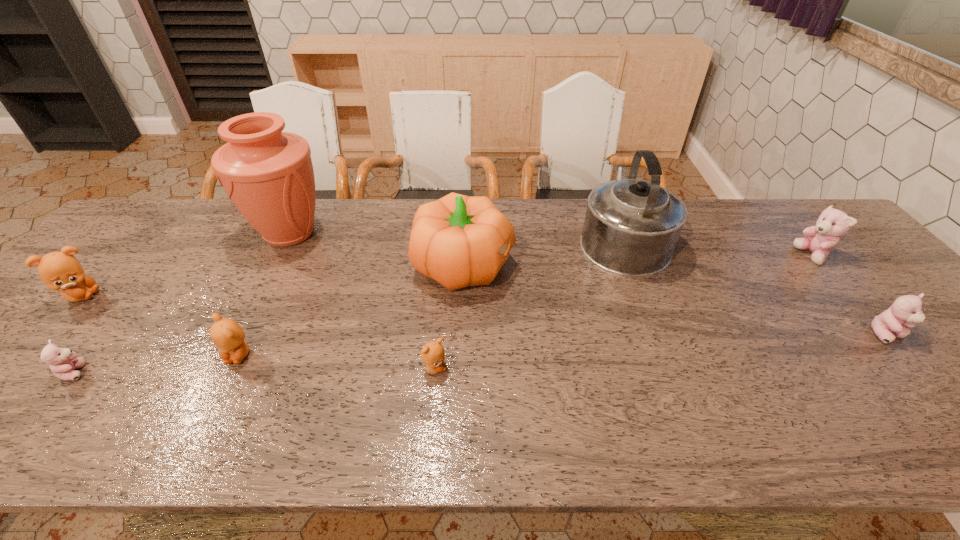
Identify the location of object that is at the left edge. This screenshot has height=540, width=960. (61, 271).

Image resolution: width=960 pixels, height=540 pixels. Identify the location of object that is at the far right corner. (832, 223).

Where is `free region at the far edge of the desktop`? The width and height of the screenshot is (960, 540). free region at the far edge of the desktop is located at coordinates (531, 244).

Where is `vacant space at the near edge of the desktop`? This screenshot has height=540, width=960. vacant space at the near edge of the desktop is located at coordinates (94, 432).

In the image, there is a desktop. At what (x,y) coordinates should I click in order to perform the action: click on vacant space at the left edge. Please return your answer as a coordinate pair (x, y). Image resolution: width=960 pixels, height=540 pixels. Looking at the image, I should click on tap(16, 377).

Find the location of a particular element. The image size is (960, 540). empty location between the pumpkin and the vase is located at coordinates (x=377, y=249).

Locate an element on the screen. free space between the rightmost brown teddy bear and the pumpkin is located at coordinates (449, 317).

Identify the location of unoccupied position between the second smallest pink teddy bear and the farthest teddy bear. (850, 295).

Where is `free spot between the smallest brown teddy bear and the gray kettle`? free spot between the smallest brown teddy bear and the gray kettle is located at coordinates (528, 303).

I want to click on empty space between the third tallest object and the gray kettle, so click(543, 252).